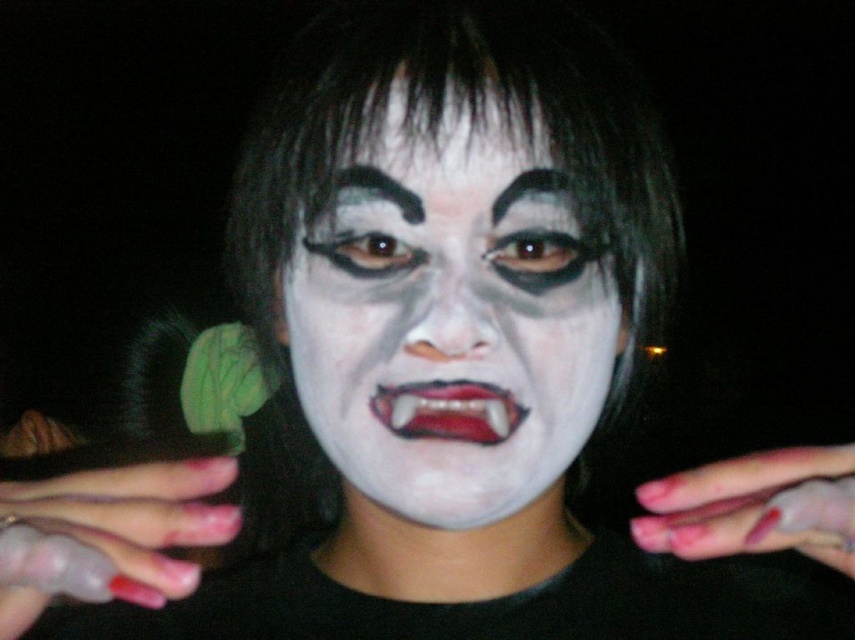
Question: Where is glossy fingernails at lower left located in relation to pink matte nails at center in the image?

Choices:
 (A) below
 (B) above

Answer: (B)

Question: Which of these objects is positioned farthest from the glossy fingernails at lower left?

Choices:
 (A) pink matte nails at center
 (B) white matte face at center

Answer: (A)

Question: Which object is closer to the camera taking this photo?

Choices:
 (A) pink matte nails at center
 (B) white matte face at center
 (C) glossy fingernails at lower left

Answer: (C)

Question: Where is glossy fingernails at lower left located in relation to pink matte nails at center in the image?

Choices:
 (A) above
 (B) below

Answer: (A)

Question: Which is farther from the white matte face at center?

Choices:
 (A) glossy fingernails at lower left
 (B) pink matte nails at center

Answer: (A)

Question: Is white matte face at center above glossy fingernails at lower left?

Choices:
 (A) yes
 (B) no

Answer: (A)